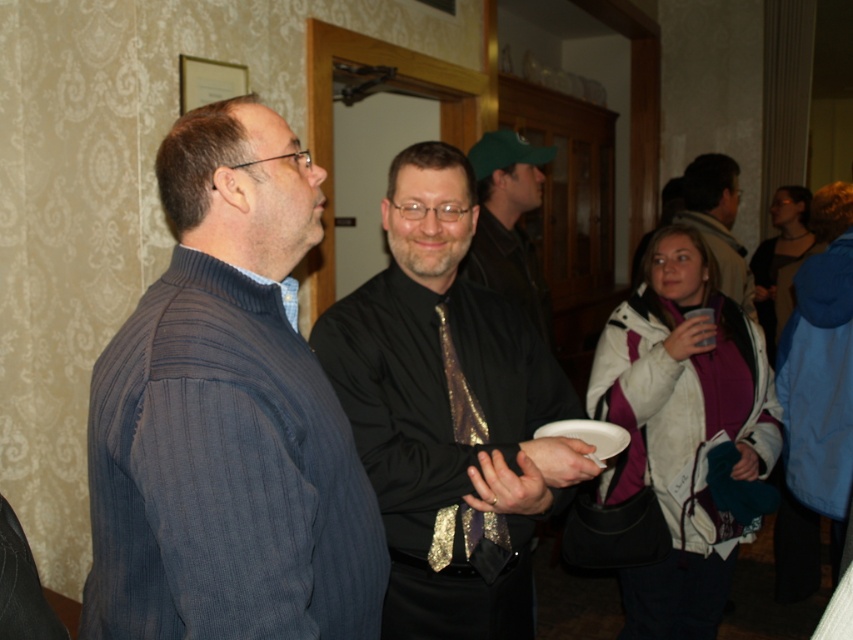
Is shiny black tie at center smaller than white paper plate at center?

Actually, shiny black tie at center might be larger than white paper plate at center.

Can you confirm if shiny black tie at center is shorter than white paper plate at center?

No.

The image size is (853, 640). Identify the location of shiny black tie at center. (508, 221).

The height and width of the screenshot is (640, 853). I want to click on shiny black tie at center, so click(508, 221).

Is shiny gold tie at center below shiny black tie at center?

Correct, shiny gold tie at center is located below shiny black tie at center.

Does shiny gold tie at center appear on the left side of shiny black tie at center?

Indeed, shiny gold tie at center is positioned on the left side of shiny black tie at center.

Which is behind, point (438, 266) or point (520, 182)?

Point (520, 182)

Find the location of `shiny gold tie at center`. shiny gold tie at center is located at coordinates (448, 412).

Is ribbed sweater at left taller than matte black shirt at center?

Indeed, ribbed sweater at left has a greater height compared to matte black shirt at center.

Between point (91, 566) and point (712, 168), which one is positioned behind?

Point (712, 168)

Where is `ribbed sweater at left`? ribbed sweater at left is located at coordinates (227, 417).

Find the location of a particular element. ribbed sweater at left is located at coordinates (227, 417).